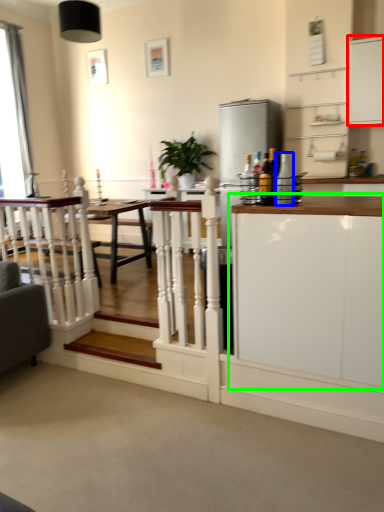
Question: Which is nearer to the cabinetry (highlighted by a red box)? bottle (highlighted by a blue box) or cabinetry (highlighted by a green box).

Choices:
 (A) bottle
 (B) cabinetry

Answer: (A)